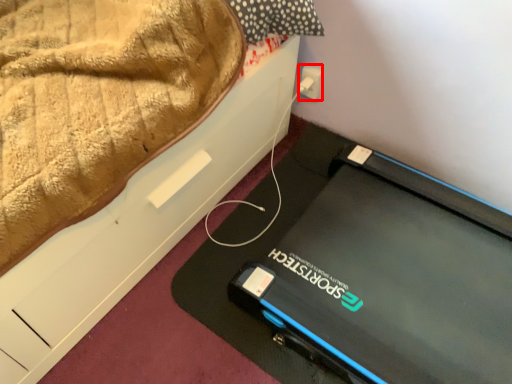
Question: From the image's perspective, where is electric outlet (annotated by the red box) located relative to furniture?

Choices:
 (A) above
 (B) below

Answer: (A)